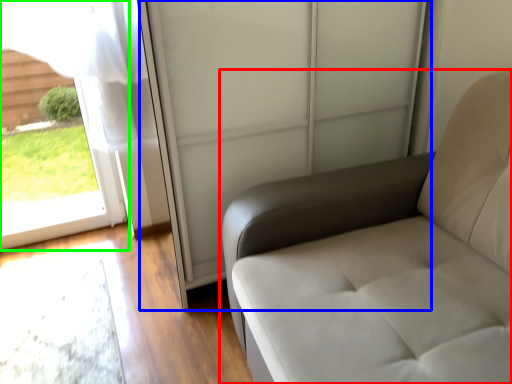
Question: Which object is positioned farthest from furniture (highlighted by a red box)? Select from screen door (highlighted by a blue box) and window (highlighted by a green box).

Choices:
 (A) screen door
 (B) window

Answer: (B)